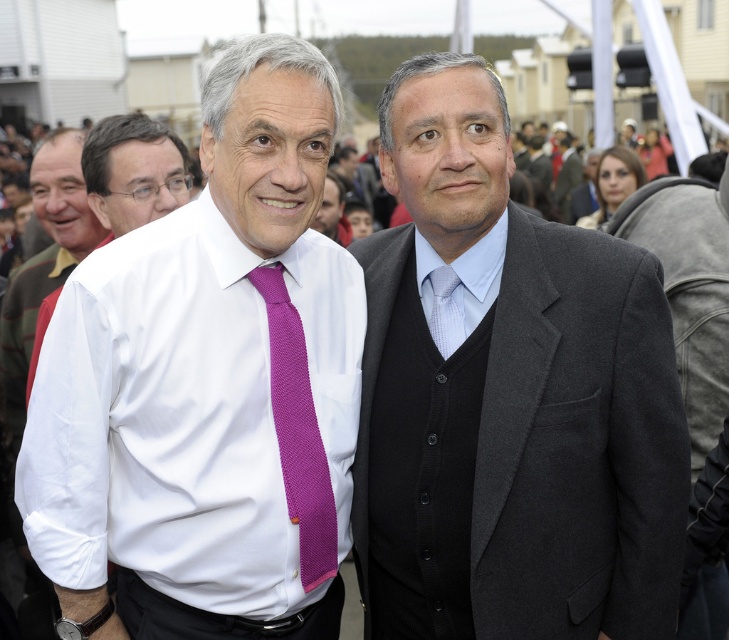
Based on the photo, how much distance is there between dark gray suit at center and white knitted dress shirt at center?

dark gray suit at center and white knitted dress shirt at center are 1.34 meters apart.

Is dark gray suit at center in front of white knitted dress shirt at center?

No.

Is point (469, 353) in front of point (61, 435)?

No.

I want to click on dark gray suit at center, so click(x=510, y=401).

From the picture: Measure the distance from white knitted dress shirt at center to white woven shirt at center.

A distance of 3.38 meters exists between white knitted dress shirt at center and white woven shirt at center.

Is point (321, 243) behind point (147, 148)?

No, it is not.

In the scene shown: Measure the distance between point (x=120, y=458) and camera.

Point (x=120, y=458) and camera are 6.11 meters apart from each other.

Locate an element on the screen. The width and height of the screenshot is (729, 640). white knitted dress shirt at center is located at coordinates (184, 416).

Is purple knitted tie at center shorter than light blue textured tie at center?

In fact, purple knitted tie at center may be taller than light blue textured tie at center.

Does purple knitted tie at center come in front of light blue textured tie at center?

Yes, purple knitted tie at center is closer to the viewer.

The width and height of the screenshot is (729, 640). I want to click on purple knitted tie at center, so click(x=297, y=432).

Identify the location of purple knitted tie at center. (297, 432).